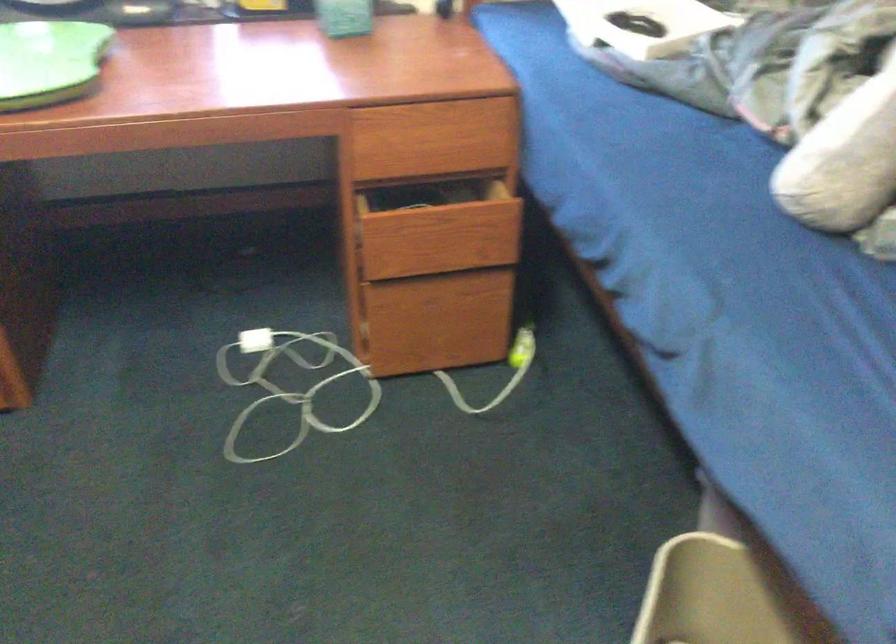
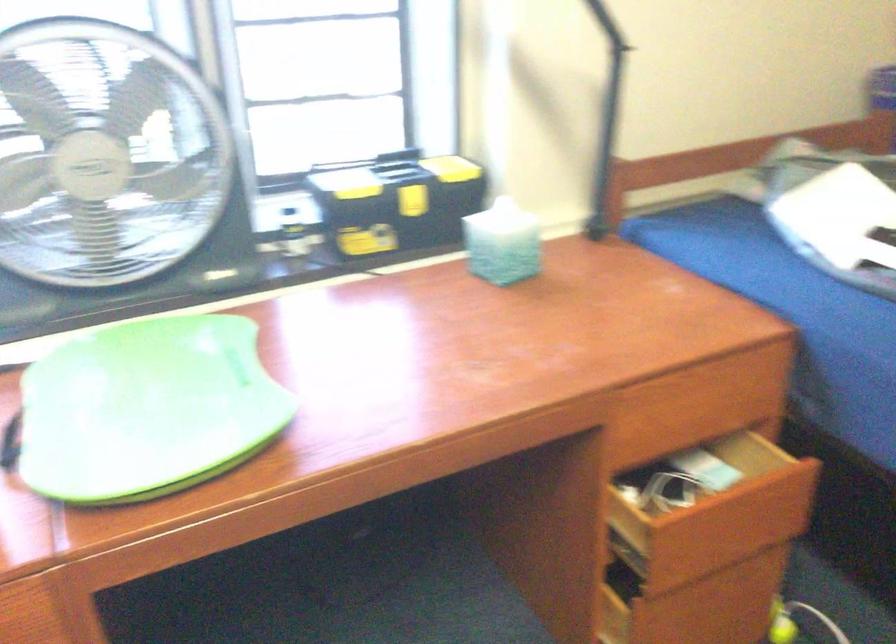
In the second image, find the point that corresponds to the point at 443,144 in the first image.

(693, 415)